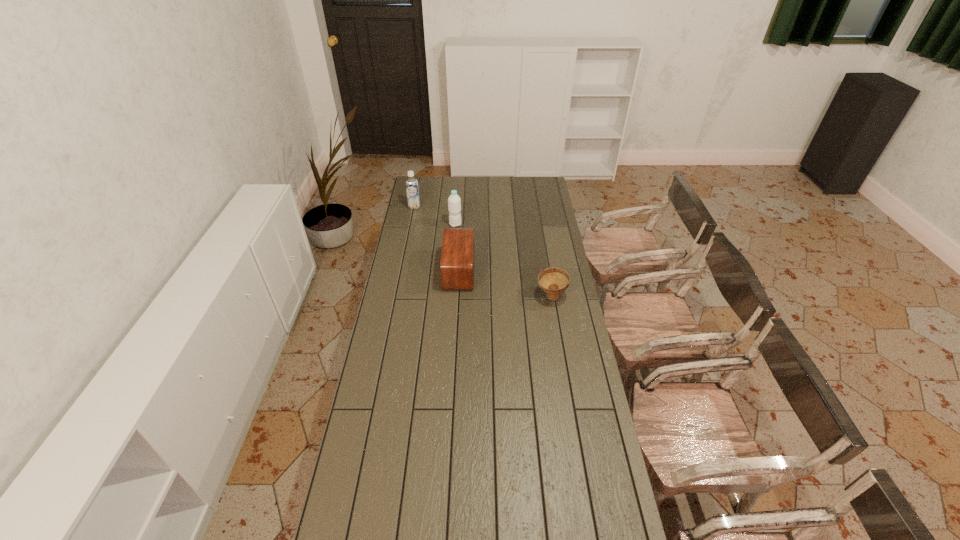
Identify the location of empty space between the radio receiver and the rightmost object. (505, 284).

At what (x,y) coordinates should I click in order to perform the action: click on object that is the third closest to the third tallest object. Please return your answer as a coordinate pair (x, y). This screenshot has width=960, height=540. Looking at the image, I should click on (412, 189).

Identify the location of object that is the closest to the soya milk. The height and width of the screenshot is (540, 960). (454, 201).

The width and height of the screenshot is (960, 540). I want to click on free point that satisfies the following two spatial constraints: 1. on the back side of the soup bowl; 2. on the front panel of the radio receiver, so click(x=547, y=271).

Locate an element on the screen. free space that satisfies the following two spatial constraints: 1. on the front panel of the second shortest object; 2. on the left side of the rightmost object is located at coordinates (458, 296).

I want to click on blank area in the image that satisfies the following two spatial constraints: 1. on the label of the soup bowl; 2. on the right side of the leftmost object, so click(396, 296).

Where is `vacant point that satisfies the following two spatial constraints: 1. on the label of the leftmost object; 2. on the left side of the soup bowl`? Image resolution: width=960 pixels, height=540 pixels. vacant point that satisfies the following two spatial constraints: 1. on the label of the leftmost object; 2. on the left side of the soup bowl is located at coordinates (396, 296).

The image size is (960, 540). I want to click on free spot that satisfies the following two spatial constraints: 1. on the front panel of the radio receiver; 2. on the right side of the soup bowl, so [458, 296].

Where is `free spot that satisfies the following two spatial constraints: 1. on the back side of the soup bowl; 2. on the front panel of the radio receiver`? This screenshot has width=960, height=540. free spot that satisfies the following two spatial constraints: 1. on the back side of the soup bowl; 2. on the front panel of the radio receiver is located at coordinates (547, 271).